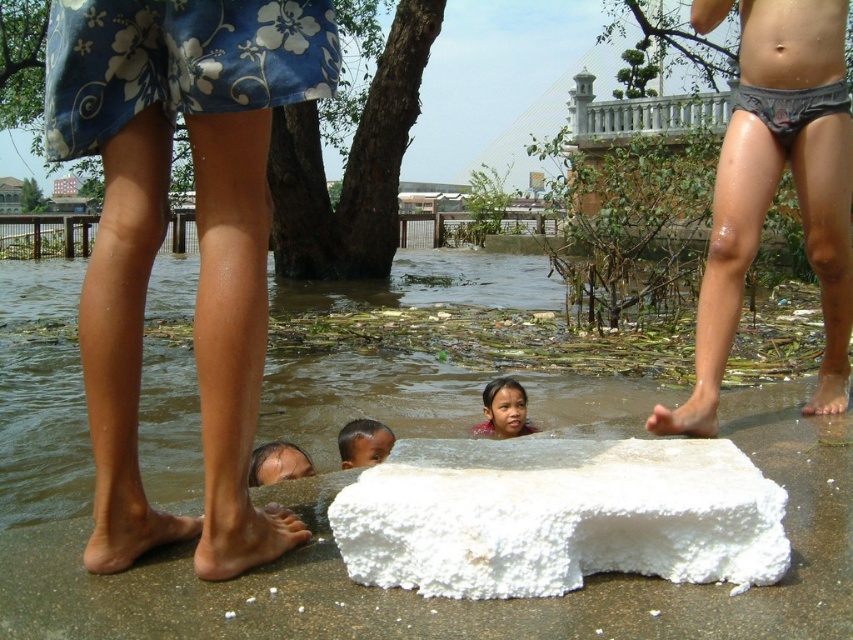
You are a lifeguard on duty at the riverbank. You notice the white foam block at center and the smooth skin child at center. The child is playing near the polluted water with debris. How far apart are these two objects?

The white foam block at center and the smooth skin child at center are 15.52 feet apart.

You are a lifeguard on duty and notice the smooth skin child at center and the white foam block at lower right. Which object is closer to the left side of the image?

The smooth skin child at center is closer to the left side of the image because it is positioned to the left of the white foam block at lower right.

You are a photographer standing at the edge of the flooded riverbank. You want to take a photo of both the two adults in the foreground and the three children playing in the water. However, your camera can only focus on one point at a time. If you focus on point A at point (329, 416), will the point B at point (715, 426) also be in focus?

Point A at point (329, 416) is closer to the camera than point B at point (715, 426). Since the camera focuses on a single plane, focusing on point A would mean point B is further away and may not be in focus. Therefore, focusing on point A might not keep point B in focus.